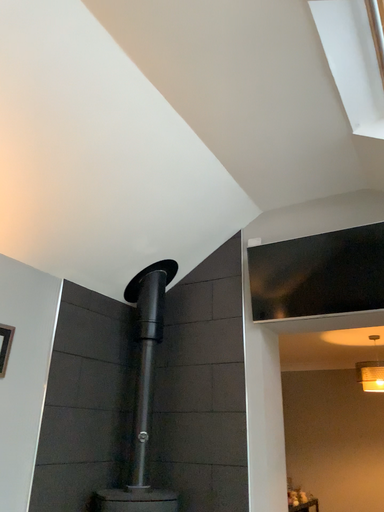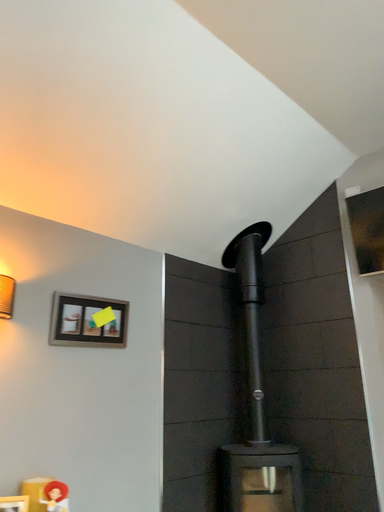
Question: How did the camera likely rotate when shooting the video?

Choices:
 (A) rotated right
 (B) rotated left

Answer: (B)